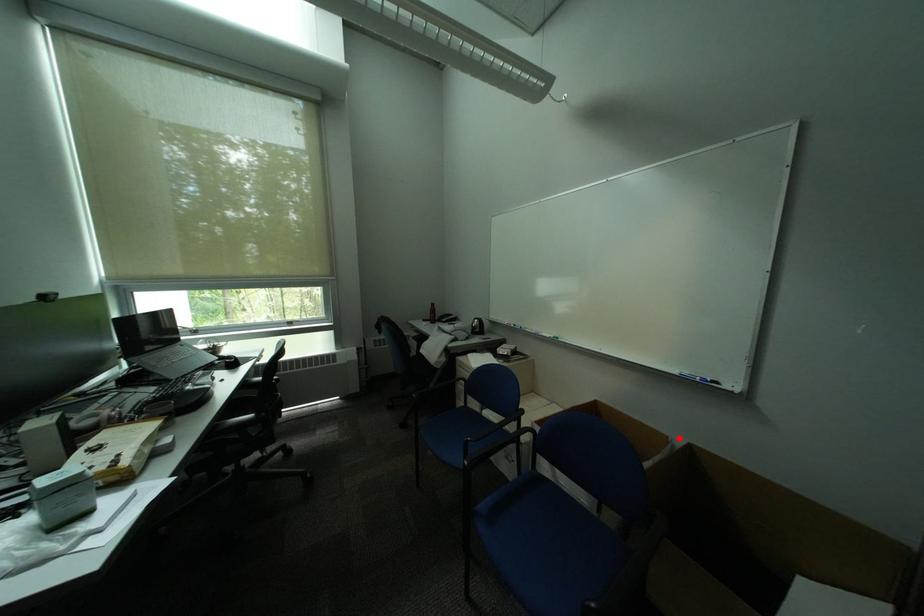
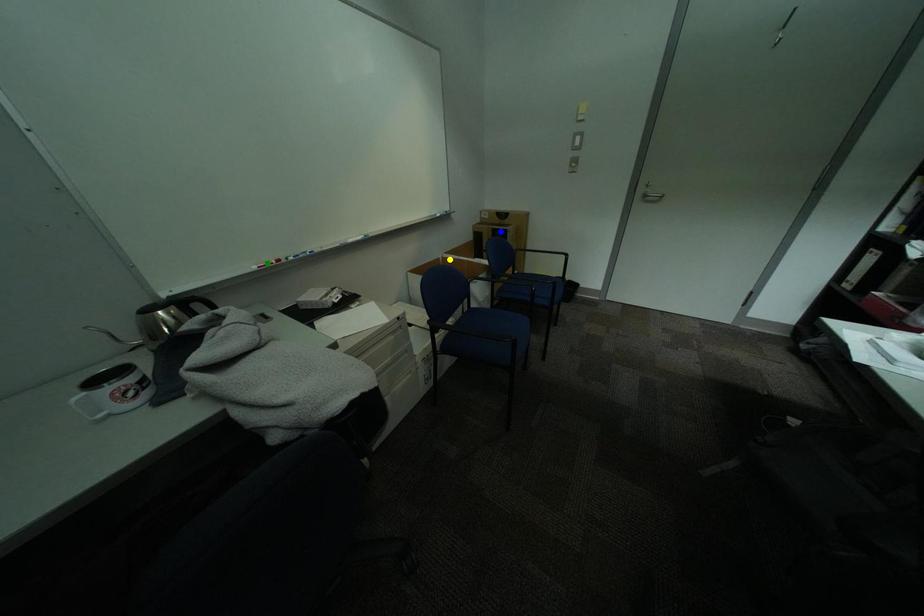
Question: I am providing you with two images of the same scene from different viewpoints. A red point is marked on the first image. You are given multiple points on the second image. Which point in image 2 represents the same 3d spot as the red point in image 1?

Choices:
 (A) blue point
 (B) yellow point
 (C) green point

Answer: (B)